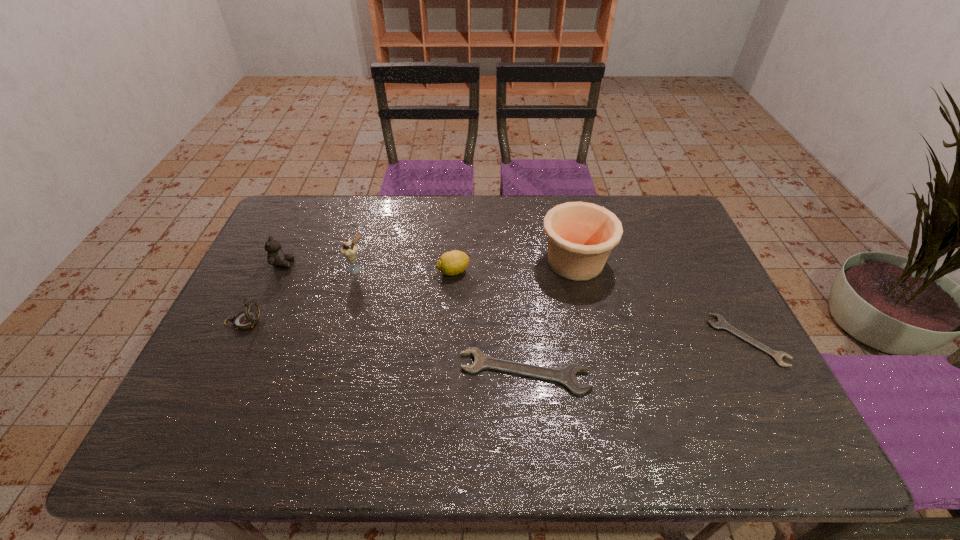
In the image, there is a desktop. Identify the location of vacant space at the far edge. The height and width of the screenshot is (540, 960). (373, 201).

Identify the location of free region at the near edge of the desktop. Image resolution: width=960 pixels, height=540 pixels. (354, 395).

In the image, there is a desktop. Where is `free region at the left edge`? free region at the left edge is located at coordinates (288, 241).

Where is `vacant position at the right edge of the desktop`? Image resolution: width=960 pixels, height=540 pixels. vacant position at the right edge of the desktop is located at coordinates (731, 359).

The image size is (960, 540). I want to click on free space at the far left corner of the desktop, so click(286, 238).

I want to click on vacant area at the far right corner, so click(x=650, y=226).

The height and width of the screenshot is (540, 960). Identify the location of vacant space that is in between the teddy bear and the pottery. (429, 262).

Where is `vacant area that lies between the right wrench and the left wrench`? This screenshot has height=540, width=960. vacant area that lies between the right wrench and the left wrench is located at coordinates (636, 356).

Locate an element on the screen. The height and width of the screenshot is (540, 960). free area in between the fifth tallest object and the icecream is located at coordinates coord(404,270).

Locate an element on the screen. free space that is in between the compass and the teddy bear is located at coordinates (263, 293).